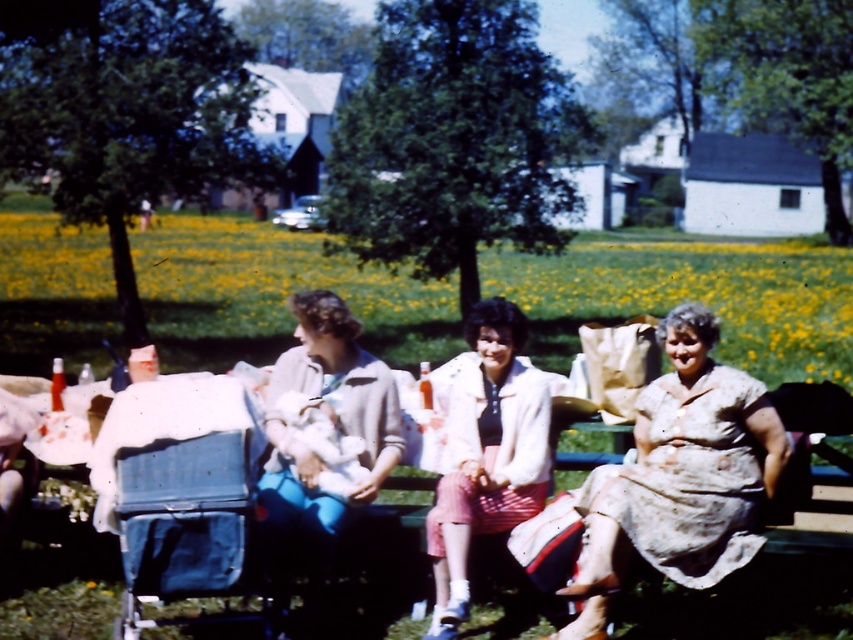
Question: Which point is closer to the camera taking this photo?

Choices:
 (A) (462, 545)
 (B) (709, 419)
 (C) (235, 390)

Answer: (C)

Question: Which point is farther to the camera?

Choices:
 (A) floral-patterned dress at center
 (B) white textured jacket at center
 (C) blue fabric baby carriage at left

Answer: (B)

Question: Estimate the real-world distances between objects in this image. Which object is farther from the blue fabric baby carriage at left?

Choices:
 (A) floral-patterned dress at center
 (B) white textured jacket at center

Answer: (A)

Question: From the image, what is the correct spatial relationship of blue fabric baby carriage at left in relation to white textured jacket at center?

Choices:
 (A) below
 (B) above

Answer: (A)

Question: In this image, where is blue fabric baby carriage at left located relative to white textured jacket at center?

Choices:
 (A) below
 (B) above

Answer: (A)

Question: Where is floral-patterned dress at center located in relation to white textured jacket at center in the image?

Choices:
 (A) right
 (B) left

Answer: (A)